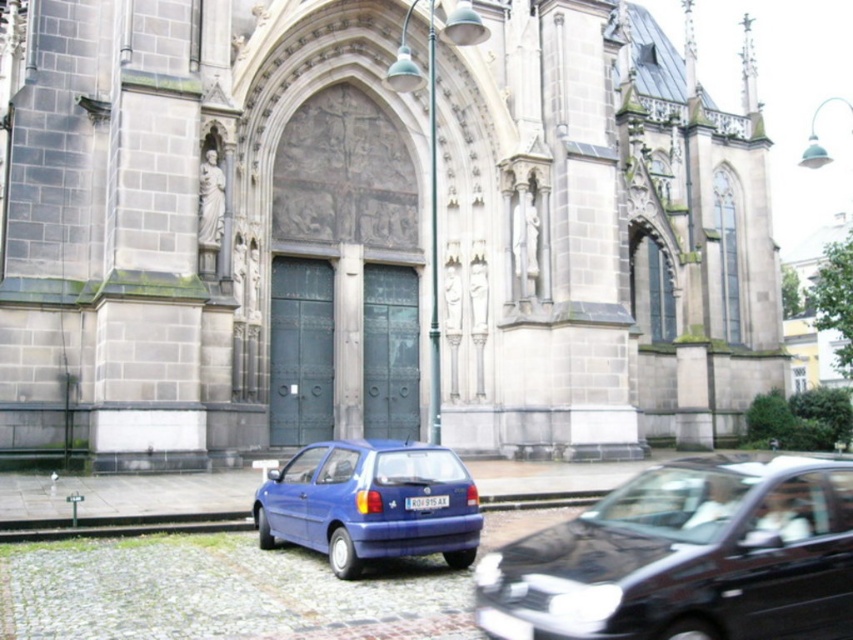
You are a pedestrian standing at the edge of the cobblestone street in front of the Gothic church. You need to cross the street to reach the entrance. The two cars parked here are the matte blue hatchback at lower left and the blue matte hatchback at lower center. Considering the distance between them, can you safely walk through the gap between these two cars to cross the street?

The matte blue hatchback at lower left and blue matte hatchback at lower center are 7.70 meters apart from each other. Since the gap between them is quite large, you can safely walk through the gap between these two cars to cross the street.

You are a photographer standing in front of the gray stone church at center and the white plastic license plate at center. You want to capture a photo that includes both objects. Which object should you focus on first to ensure both are in frame?

You should focus on the gray stone church at center first because it is taller than the white plastic license plate at center, so you need to adjust your camera angle to include its full height while still capturing the license plate in the frame.